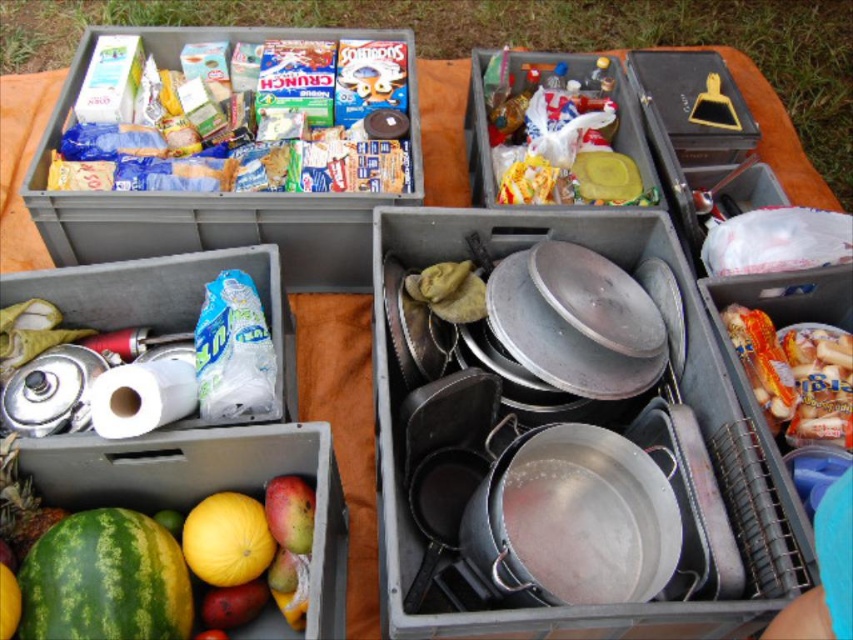
Question: Is green matte watermelon at lower left further to camera compared to yellow matte melon at lower left?

Choices:
 (A) yes
 (B) no

Answer: (B)

Question: Which point is farther to the camera?

Choices:
 (A) green rind watermelon at lower left
 (B) matte plastic crate at upper left

Answer: (B)

Question: Which point is farther from the camera taking this photo?

Choices:
 (A) (248, 536)
 (B) (79, 65)

Answer: (B)

Question: Which of the following is the closest to the observer?

Choices:
 (A) green matte watermelon at lower left
 (B) green rind watermelon at lower left

Answer: (A)

Question: Does green rind watermelon at lower left come behind yellow matte melon at lower left?

Choices:
 (A) no
 (B) yes

Answer: (A)

Question: Observing the image, what is the correct spatial positioning of green matte watermelon at lower left in reference to matte plastic crate at upper left?

Choices:
 (A) below
 (B) above

Answer: (A)